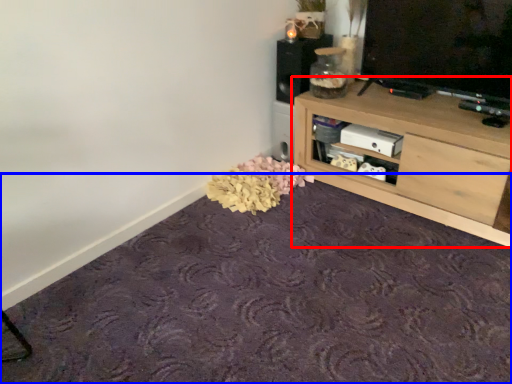
Question: Which object is closer to the camera taking this photo, shelf (highlighted by a red box) or plain (highlighted by a blue box)?

Choices:
 (A) shelf
 (B) plain

Answer: (B)